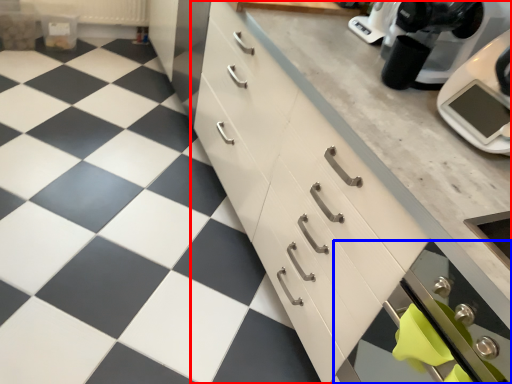
Question: Which object appears farthest to the camera in this image, cabinetry (highlighted by a red box) or oven (highlighted by a blue box)?

Choices:
 (A) cabinetry
 (B) oven

Answer: (B)